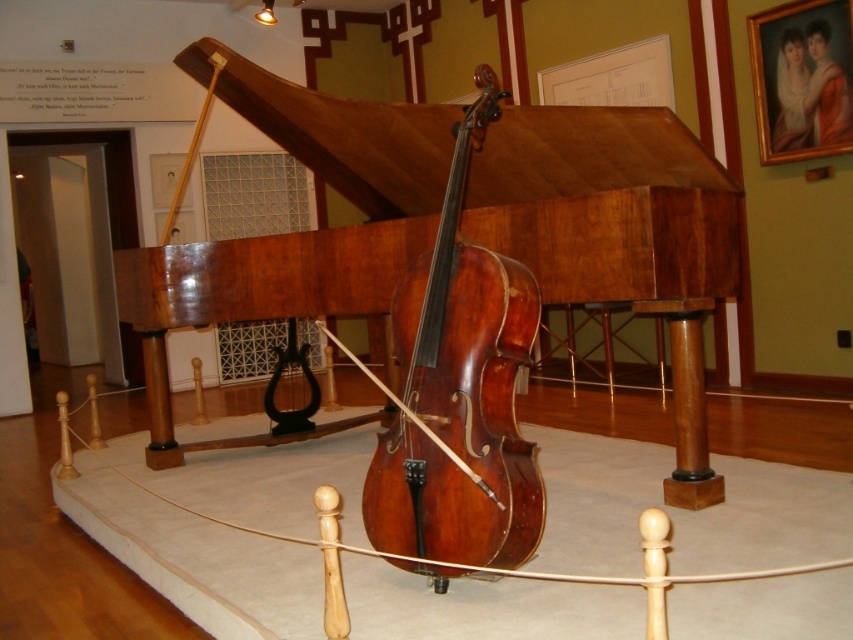
You are an art conservator tasked with moving the shiny brown wood cello at center and the matte oil painting at upper right to a new exhibition space. The entrance to the new space has a height restriction of 1.5 meters. Can both items pass through the entrance without being damaged?

The shiny brown wood cello at center has a larger size compared to the matte oil painting at upper right. However, the height of both items is not specified in the description. Therefore, it is uncertain whether they can pass through the entrance with a 1.5 meter height restriction. Further measurements are needed.

You are a visitor in the museum and want to take a photo of both the shiny polished wood piano at center and the matte oil painting at upper right. The camera you have can only focus on objects within 10 feet of each other. Is this possible?

The shiny polished wood piano at center is 9.56 feet away from the matte oil painting at upper right, so yes, the camera can focus on both since the distance is within the 10 feet limit.